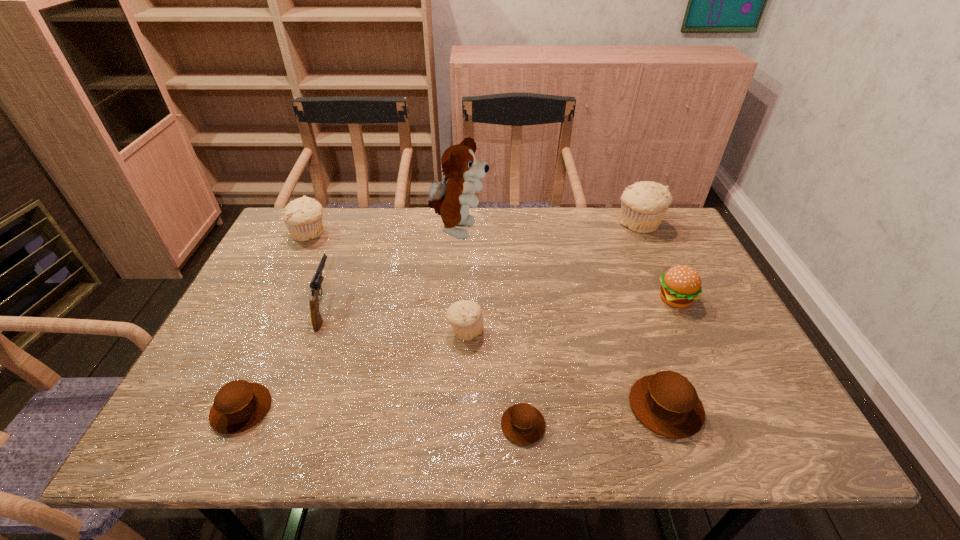
Select which object is the closest to the hamburger. Please provide its 2D coordinates. Your answer should be formatted as a tuple, i.e. [(x, y)], where the tuple contains the x and y coordinates of a point satisfying the conditions above.

[(666, 403)]

What are the coordinates of `muffin that is the closest to the tallest muffin` in the screenshot? It's located at (666, 403).

This screenshot has width=960, height=540. I want to click on the fourth closest muffin to the brown puppy, so click(523, 424).

Find the location of a particular element. the third closest beige muffin relative to the black gun is located at coordinates [643, 204].

Select which beige muffin appears as the closest to the rightmost brown muffin. Please provide its 2D coordinates. Your answer should be formatted as a tuple, i.e. [(x, y)], where the tuple contains the x and y coordinates of a point satisfying the conditions above.

[(466, 317)]

Point out which brown muffin is positioned as the second nearest to the second biggest brown muffin. Please provide its 2D coordinates. Your answer should be formatted as a tuple, i.e. [(x, y)], where the tuple contains the x and y coordinates of a point satisfying the conditions above.

[(666, 403)]

Point out which brown muffin is positioned as the nearest to the rightmost brown muffin. Please provide its 2D coordinates. Your answer should be formatted as a tuple, i.e. [(x, y)], where the tuple contains the x and y coordinates of a point satisfying the conditions above.

[(523, 424)]

In order to click on free space that satisfies the following two spatial constraints: 1. on the front side of the second biggest brown muffin; 2. on the left side of the second biggest beige muffin in this screenshot , I will do `click(225, 409)`.

Where is `vacant space that satisfies the following two spatial constraints: 1. on the front side of the nearest beige muffin; 2. on the right side of the leftmost beige muffin`? The width and height of the screenshot is (960, 540). vacant space that satisfies the following two spatial constraints: 1. on the front side of the nearest beige muffin; 2. on the right side of the leftmost beige muffin is located at coordinates (262, 330).